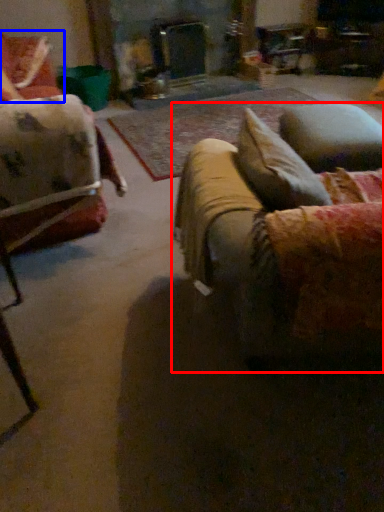
Question: Which of the following is the closest to the observer, studio couch (highlighted by a red box) or chair (highlighted by a blue box)?

Choices:
 (A) studio couch
 (B) chair

Answer: (A)